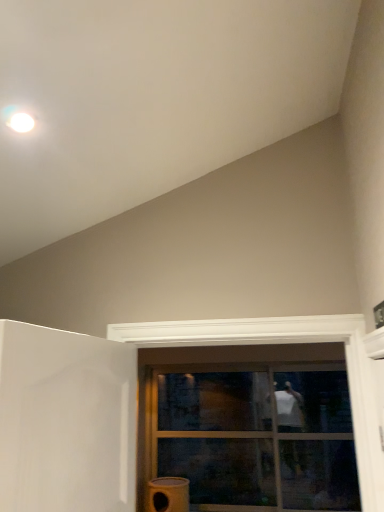
Question: From the image's perspective, is transparent glass door at center located beneath clear glass window at center?

Choices:
 (A) no
 (B) yes

Answer: (B)

Question: Does transparent glass door at center have a lesser width compared to clear glass window at center?

Choices:
 (A) no
 (B) yes

Answer: (B)

Question: Considering the relative sizes of transparent glass door at center and clear glass window at center in the image provided, is transparent glass door at center shorter than clear glass window at center?

Choices:
 (A) yes
 (B) no

Answer: (A)

Question: Considering the relative sizes of transparent glass door at center and clear glass window at center in the image provided, is transparent glass door at center smaller than clear glass window at center?

Choices:
 (A) yes
 (B) no

Answer: (A)

Question: Is transparent glass door at center closer to the viewer compared to clear glass window at center?

Choices:
 (A) yes
 (B) no

Answer: (B)

Question: Can you confirm if transparent glass door at center is wider than clear glass window at center?

Choices:
 (A) yes
 (B) no

Answer: (B)

Question: Is the surface of clear glass window at center in direct contact with matte yellow water heater at lower center?

Choices:
 (A) no
 (B) yes

Answer: (A)

Question: From a real-world perspective, is clear glass window at center beneath matte yellow water heater at lower center?

Choices:
 (A) no
 (B) yes

Answer: (A)

Question: Is there a large distance between clear glass window at center and matte yellow water heater at lower center?

Choices:
 (A) no
 (B) yes

Answer: (A)

Question: Can you confirm if clear glass window at center is thinner than matte yellow water heater at lower center?

Choices:
 (A) no
 (B) yes

Answer: (A)

Question: Can you confirm if clear glass window at center is positioned to the right of matte yellow water heater at lower center?

Choices:
 (A) yes
 (B) no

Answer: (A)

Question: Could matte yellow water heater at lower center be considered to be inside clear glass window at center?

Choices:
 (A) yes
 (B) no

Answer: (B)

Question: Considering the relative positions of clear glass window at center and transparent glass door at center in the image provided, is clear glass window at center to the left of transparent glass door at center from the viewer's perspective?

Choices:
 (A) no
 (B) yes

Answer: (A)